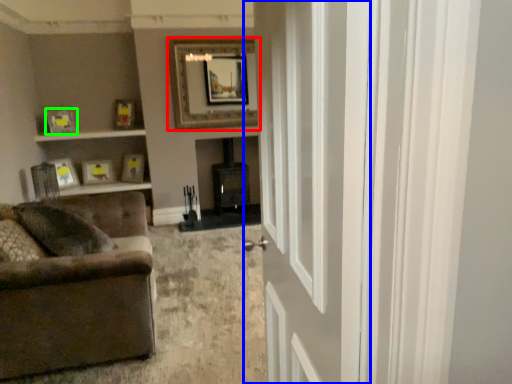
Question: Based on their relative distances, which object is farther from picture frame (highlighted by a red box)? Choose from door (highlighted by a blue box) and picture frame (highlighted by a green box).

Choices:
 (A) door
 (B) picture frame

Answer: (A)